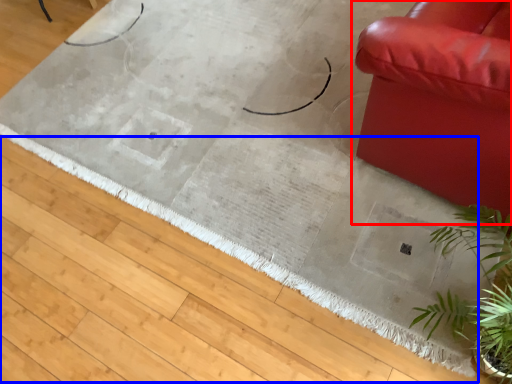
Question: Which point is closer to the camera, studio couch (highlighted by a red box) or doormat (highlighted by a blue box)?

Choices:
 (A) studio couch
 (B) doormat

Answer: (A)